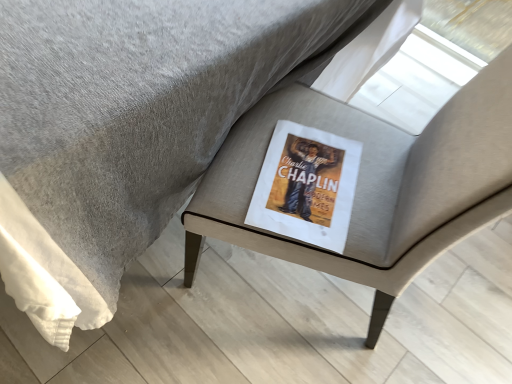
Question: From a real-world perspective, is matte gray cushion at center above or below matte paper book at center?

Choices:
 (A) above
 (B) below

Answer: (A)

Question: Is point (485, 94) positioned closer to the camera than point (287, 213)?

Choices:
 (A) farther
 (B) closer

Answer: (B)

Question: In terms of size, does matte gray cushion at center appear bigger or smaller than matte paper book at center?

Choices:
 (A) big
 (B) small

Answer: (A)

Question: From a real-world perspective, is matte paper book at center physically located above or below matte gray cushion at center?

Choices:
 (A) above
 (B) below

Answer: (B)

Question: From the image's perspective, is matte paper book at center located above or below matte gray cushion at center?

Choices:
 (A) below
 (B) above

Answer: (A)

Question: Looking at their shapes, would you say matte paper book at center is wider or thinner than matte gray cushion at center?

Choices:
 (A) wide
 (B) thin

Answer: (B)

Question: Is matte paper book at center bigger or smaller than matte gray cushion at center?

Choices:
 (A) small
 (B) big

Answer: (A)